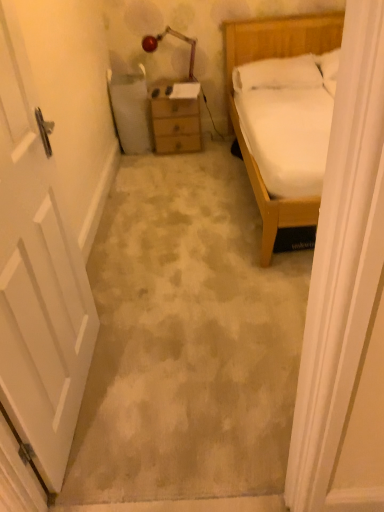
This screenshot has height=512, width=384. In order to click on vacant space underneath white matte door at left (from a real-world perspective) in this screenshot , I will do click(x=87, y=391).